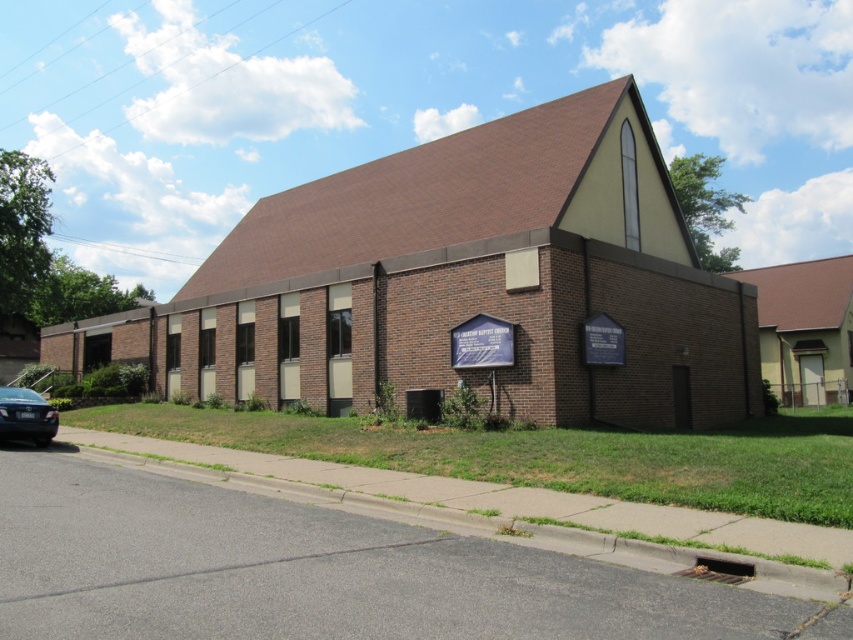
Does point (328, 314) lie in front of point (24, 412)?

No, (328, 314) is further to viewer.

Consider the image. Which is more to the left, brown brick church at center or shiny black sedan at lower left?

shiny black sedan at lower left

Is point (436, 320) in front of point (32, 396)?

No.

This screenshot has width=853, height=640. Identify the location of brown brick church at center. (462, 284).